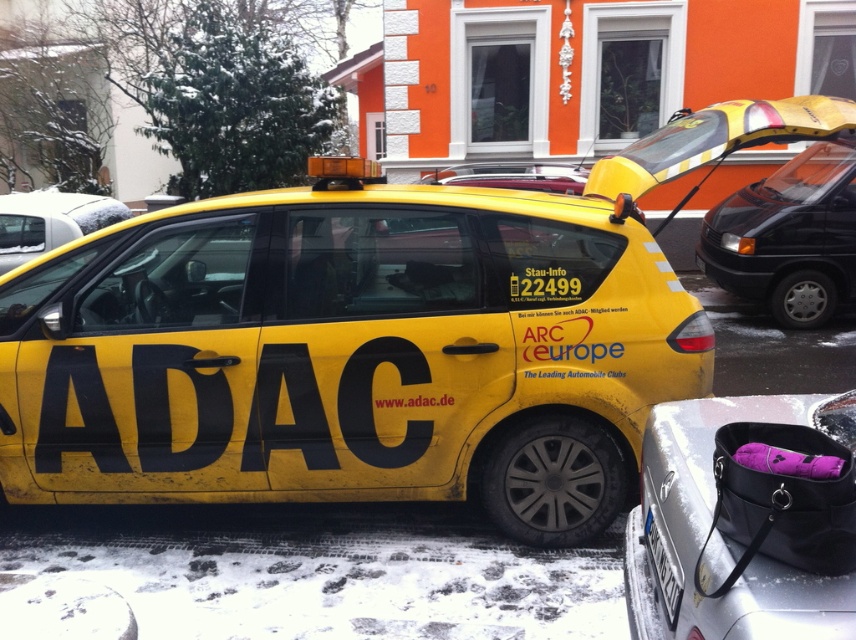
Who is positioned more to the left, yellow matte taxi at center or yellow matte car at center?

From the viewer's perspective, yellow matte car at center appears more on the left side.

Does yellow matte taxi at center appear under yellow matte car at center?

Yes.

Where is `yellow matte taxi at center`? This screenshot has height=640, width=856. yellow matte taxi at center is located at coordinates (372, 339).

This screenshot has height=640, width=856. I want to click on yellow matte taxi at center, so click(x=372, y=339).

Which is behind, point (638, 163) or point (678, 576)?

Point (638, 163)

Is point (220, 349) positioned in front of point (666, 547)?

No, it is behind (666, 547).

Where is `yellow matte taxi at center`? Image resolution: width=856 pixels, height=640 pixels. yellow matte taxi at center is located at coordinates (372, 339).

Between black leather handbag at lower right and white plastic license plate at lower center, which one has more height?

black leather handbag at lower right is taller.

Is black leather handbag at lower right shorter than white plastic license plate at lower center?

In fact, black leather handbag at lower right may be taller than white plastic license plate at lower center.

Does point (783, 481) lie in front of point (658, 563)?

Yes, it is.

At what (x,y) coordinates should I click in order to perform the action: click on black leather handbag at lower right. Please return your answer as a coordinate pair (x, y). Looking at the image, I should click on (744, 520).